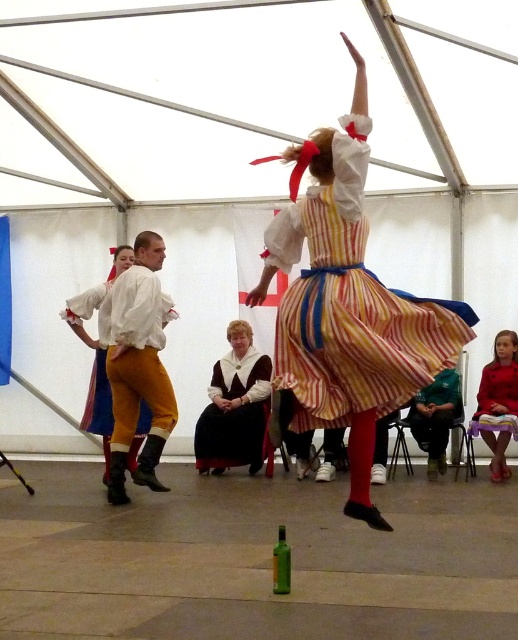
Does point (261, 449) come in front of point (494, 372)?

No, (261, 449) is behind (494, 372).

Which of these two, velvet brown dress at center or velvet red dress at center, stands shorter?

velvet red dress at center is shorter.

The height and width of the screenshot is (640, 518). I want to click on velvet brown dress at center, so click(234, 412).

Does green fabric pants at lower right have a greater height compared to velvet red dress at center?

Indeed, green fabric pants at lower right has a greater height compared to velvet red dress at center.

This screenshot has height=640, width=518. What do you see at coordinates (436, 417) in the screenshot? I see `green fabric pants at lower right` at bounding box center [436, 417].

You are a GUI agent. You are given a task and a screenshot of the screen. Output one action in this format:
    pyautogui.click(x=<x>, y=<y>)
    Task: Click on the green fabric pants at lower right
    The height and width of the screenshot is (640, 518).
    Given the screenshot: What is the action you would take?
    pyautogui.click(x=436, y=417)

Can you confirm if striped cotton dress at center is positioned above velvet red dress at center?

Indeed, striped cotton dress at center is positioned over velvet red dress at center.

This screenshot has width=518, height=640. What are the coordinates of `striped cotton dress at center` in the screenshot? It's located at (350, 307).